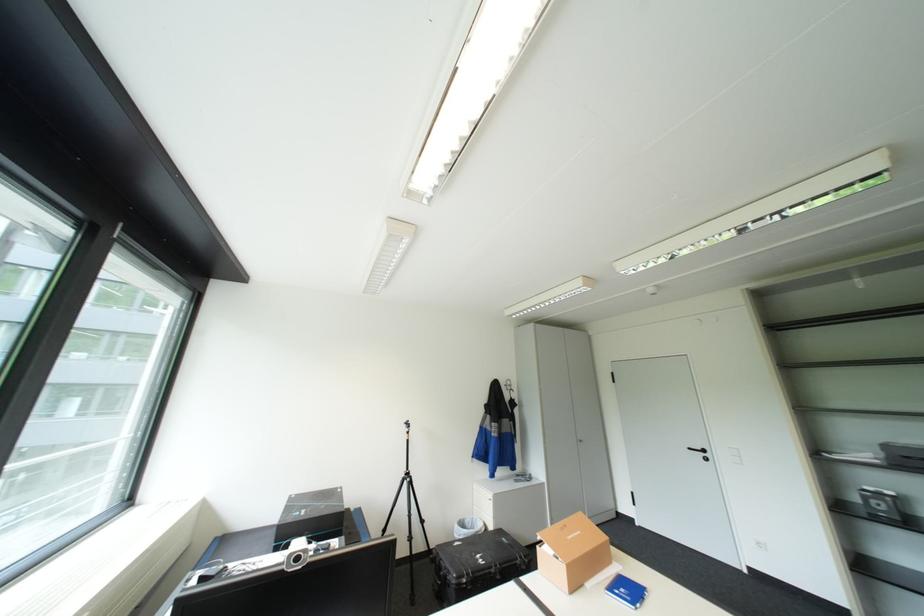
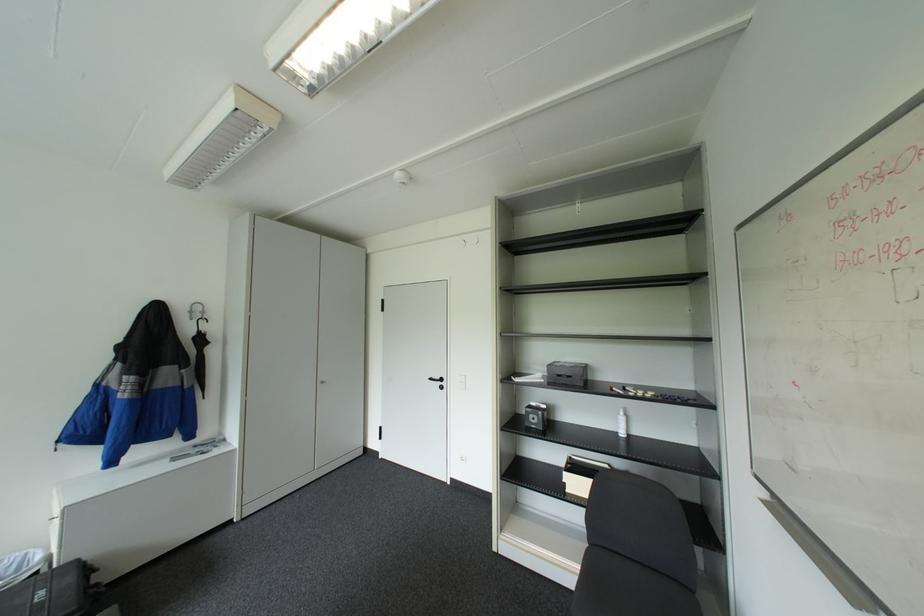
Where in the second image is the point corresponding to point (516, 389) from the first image?

(200, 318)